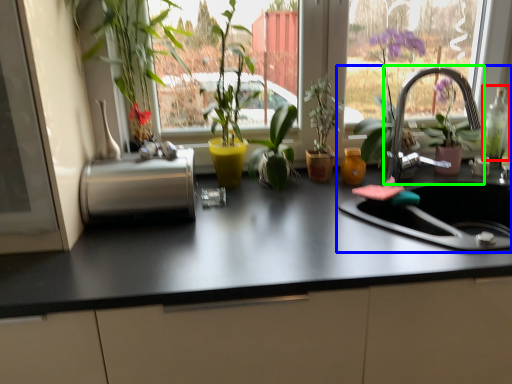
Question: Considering the real-world distances, which object is farthest from bottle (highlighted by a red box)? sink (highlighted by a blue box) or tap (highlighted by a green box)?

Choices:
 (A) sink
 (B) tap

Answer: (A)